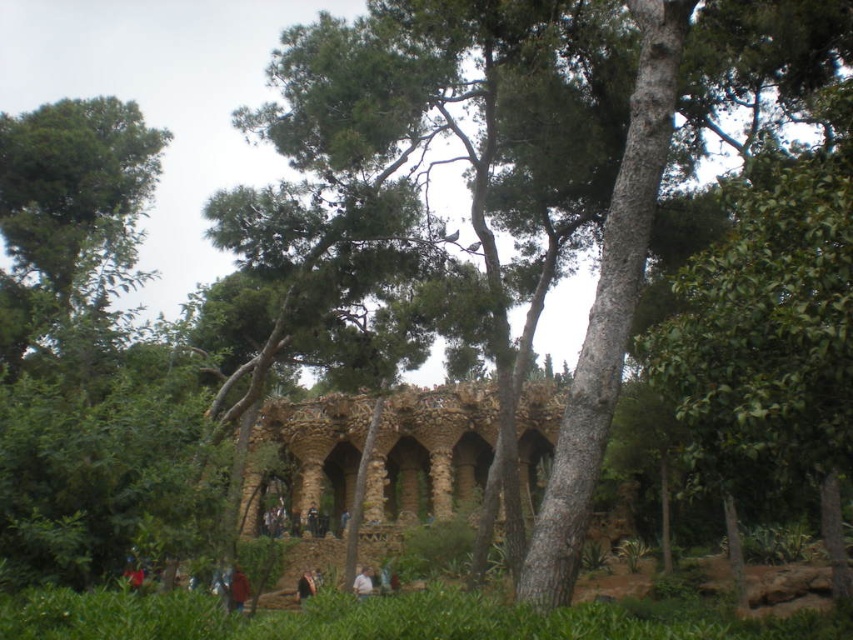
You are standing in the park and want to take a photo of the brown stone ruins at center. Based on their position, which direction should you face to ensure they are centered in your camera view?

The brown stone ruins at center are located at coordinates point (428,454), so you should face towards the center of the image to capture them in the frame.

You are standing in the park and see the brown stone ruins at center and the red fabric person at lower center. Which object is taller?

The brown stone ruins at center is much taller than the red fabric person at lower center.

You are a park visitor who just arrived and see two jackets in the scene. Which jacket is closer to you, the brown leather jacket at lower center or the dark brown leather jacket at center?

The brown leather jacket at lower center is closer to you because it is in front of the dark brown leather jacket at center.